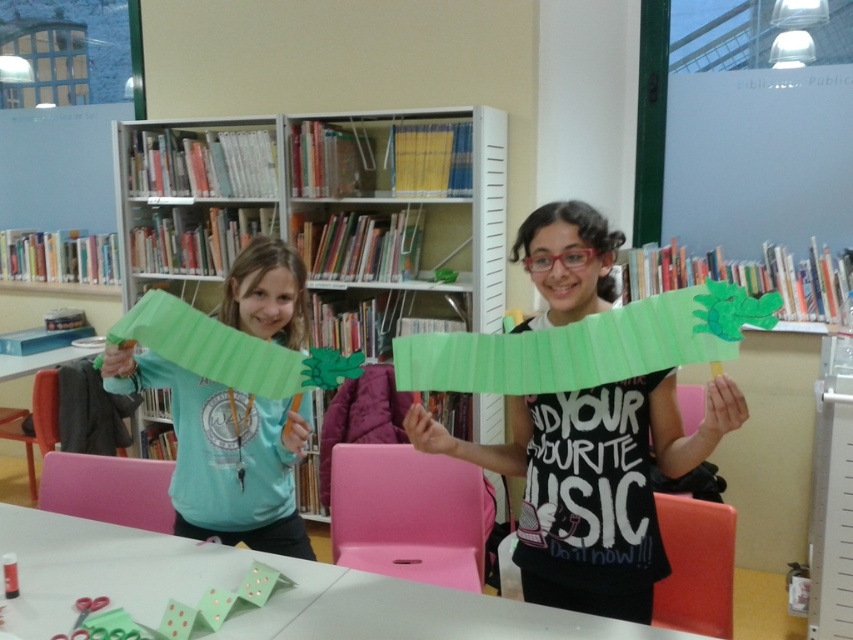
Question: Which object is farther from the camera taking this photo?

Choices:
 (A) white matte table at lower center
 (B) matte cardboard bookcase at center
 (C) green paper craft at center

Answer: (B)

Question: Does matte cardboard bookcase at center have a smaller size compared to matte green paper dragon at left?

Choices:
 (A) yes
 (B) no

Answer: (B)

Question: Estimate the real-world distances between objects in this image. Which object is closer to the matte cardboard bookcase at center?

Choices:
 (A) matte green paper dragon at left
 (B) green paper craft at center
 (C) white matte table at lower center

Answer: (A)

Question: Is white matte table at lower center thinner than matte green paper dragon at left?

Choices:
 (A) no
 (B) yes

Answer: (A)

Question: Is green paper craft at center above white matte table at lower center?

Choices:
 (A) yes
 (B) no

Answer: (A)

Question: Which of the following is the farthest from the observer?

Choices:
 (A) matte green paper dragon at left
 (B) green paper craft at center
 (C) matte cardboard bookcase at center

Answer: (C)